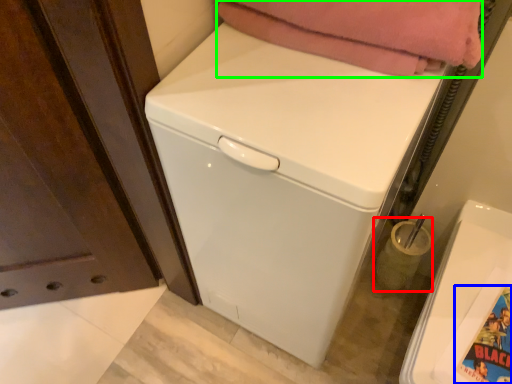
Question: Based on their relative distances, which object is nearer to appliance (highlighted by a red box)? Choose from comic book character (highlighted by a blue box) and blanket (highlighted by a green box).

Choices:
 (A) comic book character
 (B) blanket

Answer: (A)